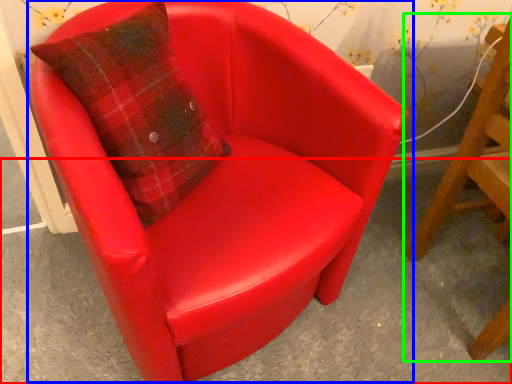
Question: Which is nearer to the concrete (highlighted by a red box)? chair (highlighted by a blue box) or chair (highlighted by a green box).

Choices:
 (A) chair
 (B) chair

Answer: (B)